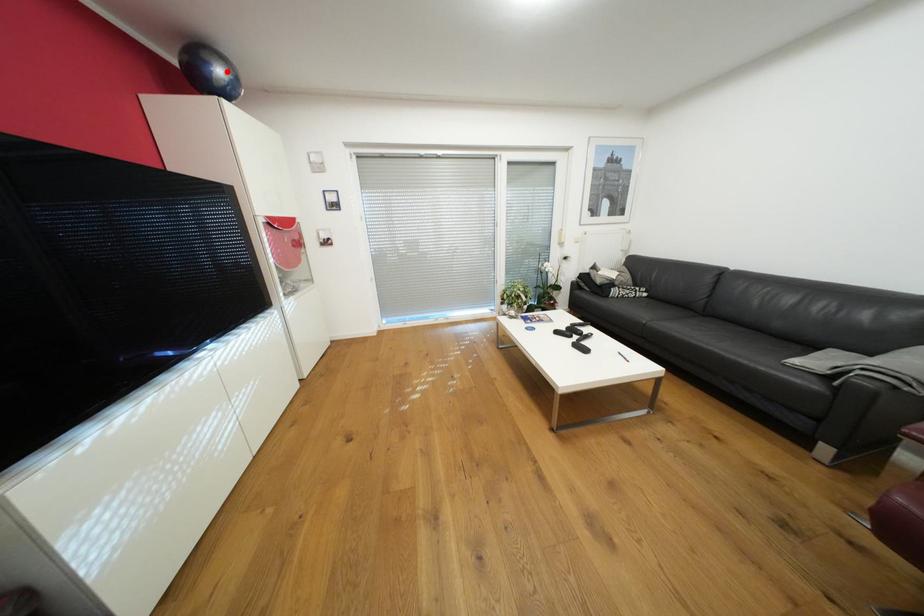
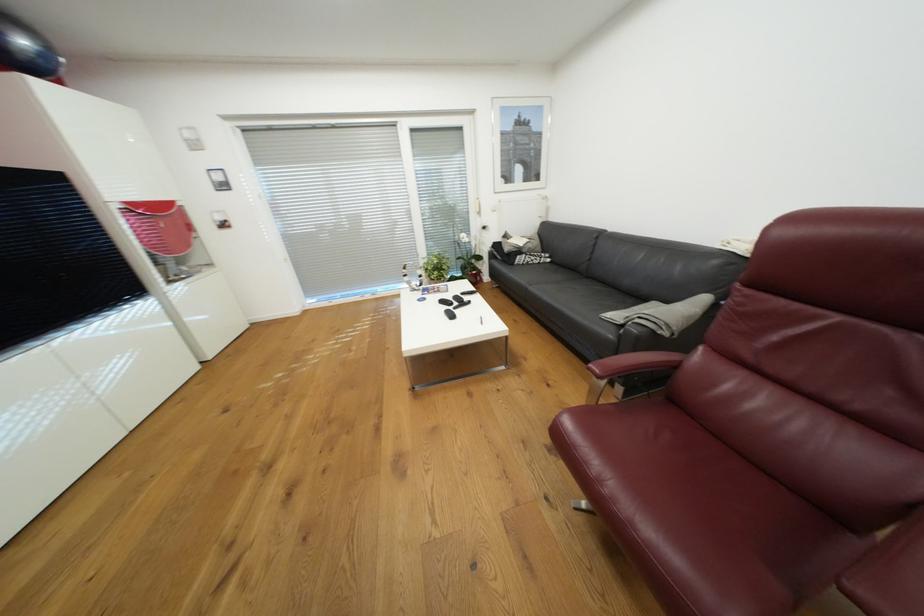
Locate, in the second image, the point that corresponds to the highlighted location in the first image.

(29, 42)